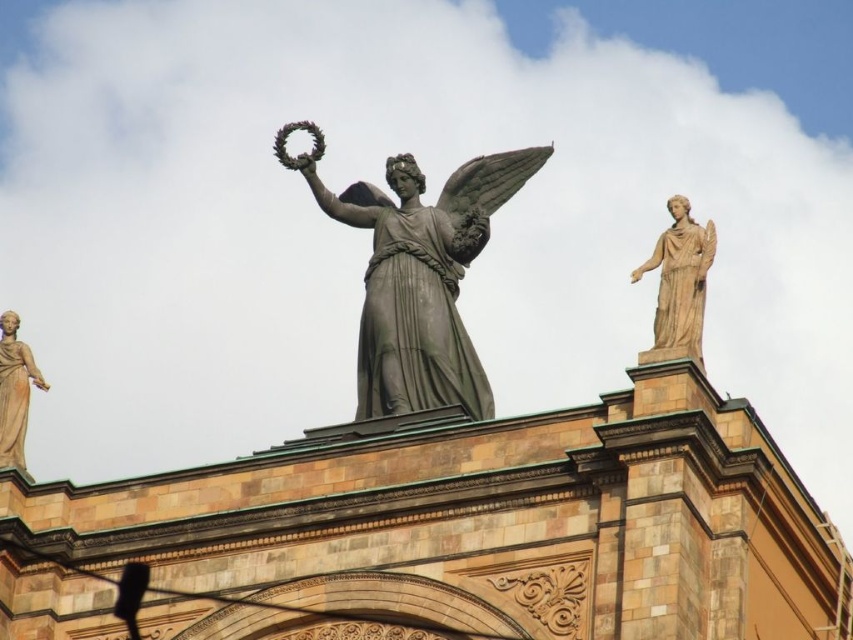
Question: Which point is closer to the camera?

Choices:
 (A) matte gray statue at center
 (B) matte beige statue at left
 (C) beige marble statue at upper right

Answer: (C)

Question: Is beige marble statue at upper right closer to the viewer compared to matte beige statue at left?

Choices:
 (A) no
 (B) yes

Answer: (B)

Question: Which point is closer to the camera taking this photo?

Choices:
 (A) (686, 330)
 (B) (26, 381)

Answer: (A)

Question: Observing the image, what is the correct spatial positioning of matte gray statue at center in reference to beige marble statue at upper right?

Choices:
 (A) left
 (B) right

Answer: (A)

Question: Is matte gray statue at center smaller than matte beige statue at left?

Choices:
 (A) no
 (B) yes

Answer: (A)

Question: Estimate the real-world distances between objects in this image. Which object is closer to the beige marble statue at upper right?

Choices:
 (A) matte beige statue at left
 (B) matte gray statue at center

Answer: (B)